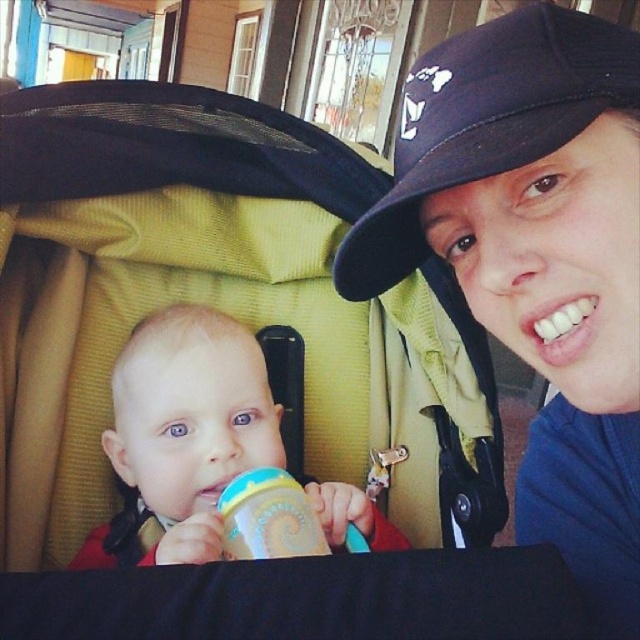
Question: Does navy blue fabric cap at upper right have a larger size compared to blue plastic sippy cup at center?

Choices:
 (A) no
 (B) yes

Answer: (B)

Question: Where is smooth plastic cup at center located in relation to blue plastic sippy cup at center in the image?

Choices:
 (A) left
 (B) right

Answer: (A)

Question: Which is farther from the smooth plastic cup at center?

Choices:
 (A) navy blue fabric cap at upper right
 (B) blue fabric cap at upper center

Answer: (B)

Question: Which object is farther from the camera taking this photo?

Choices:
 (A) navy blue fabric cap at upper right
 (B) blue plastic sippy cup at center
 (C) blue fabric cap at upper center

Answer: (B)

Question: Considering the relative positions of navy blue fabric cap at upper right and blue plastic sippy cup at center in the image provided, where is navy blue fabric cap at upper right located with respect to blue plastic sippy cup at center?

Choices:
 (A) right
 (B) left

Answer: (A)

Question: Estimate the real-world distances between objects in this image. Which object is farther from the smooth plastic cup at center?

Choices:
 (A) blue fabric cap at upper center
 (B) navy blue fabric cap at upper right
 (C) blue plastic sippy cup at center

Answer: (A)